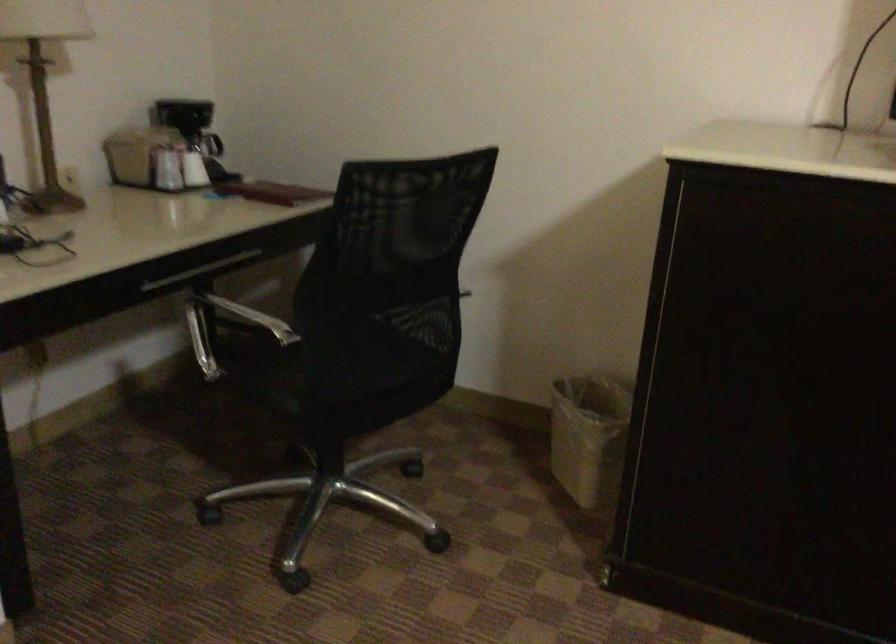
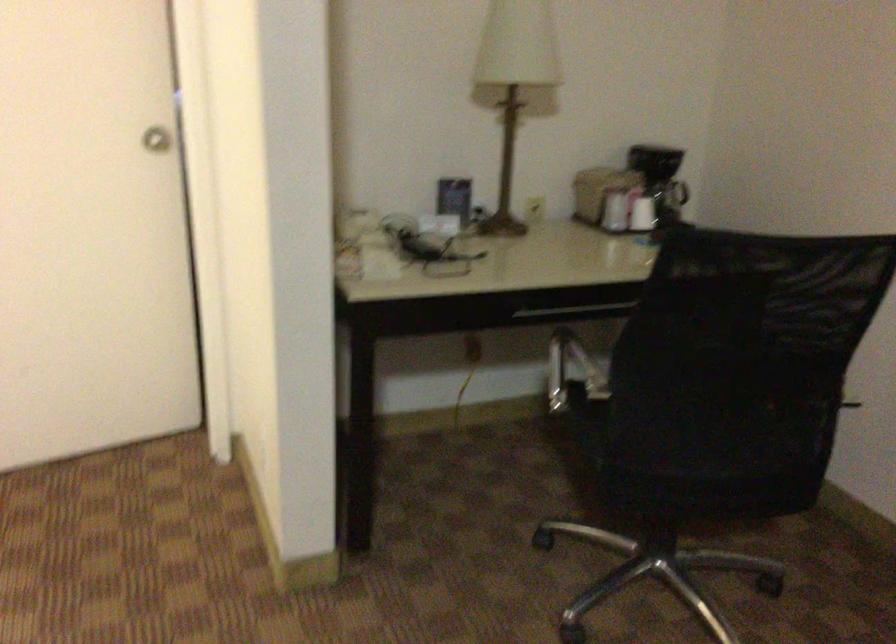
The point at (144, 149) is marked in the first image. Where is the corresponding point in the second image?

(599, 190)